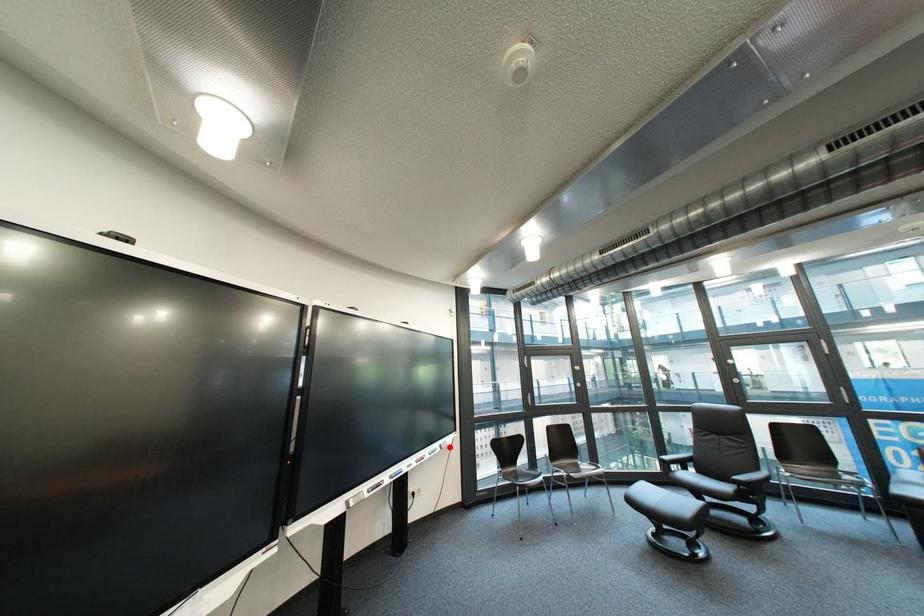
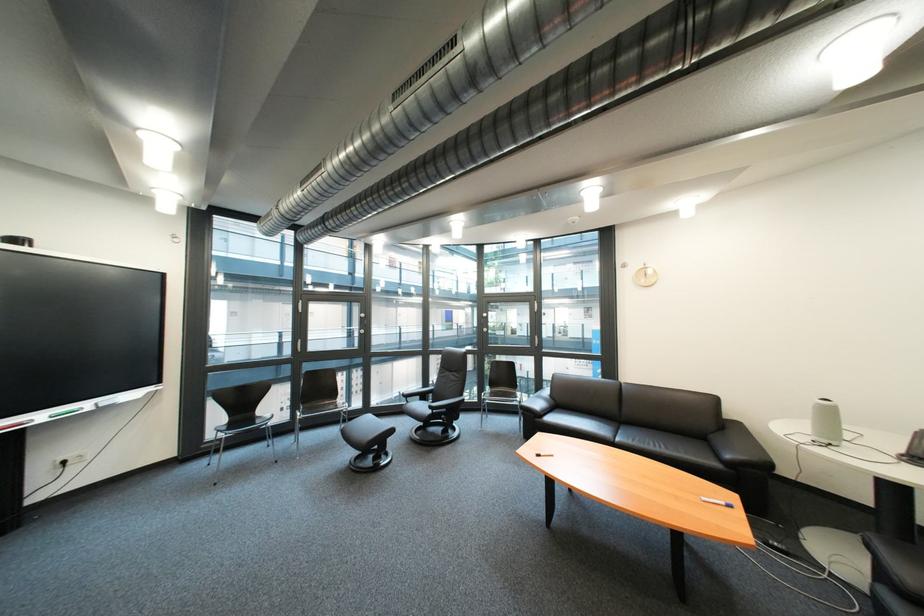
Question: I am providing you with two images of the same scene from different viewpoints. A red point is marked on the first image. Is the red point's position out of view in image 2?

Choices:
 (A) Yes
 (B) No

Answer: (B)